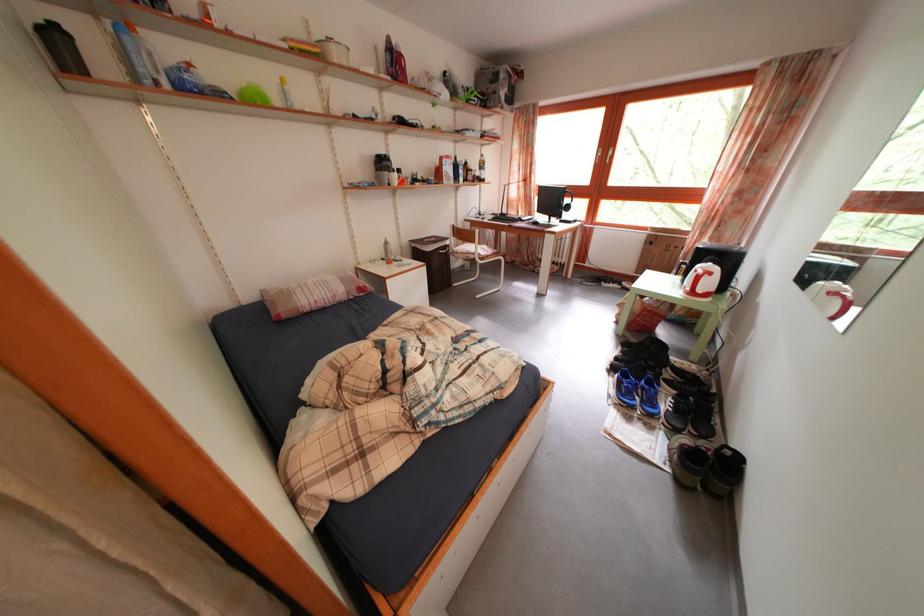
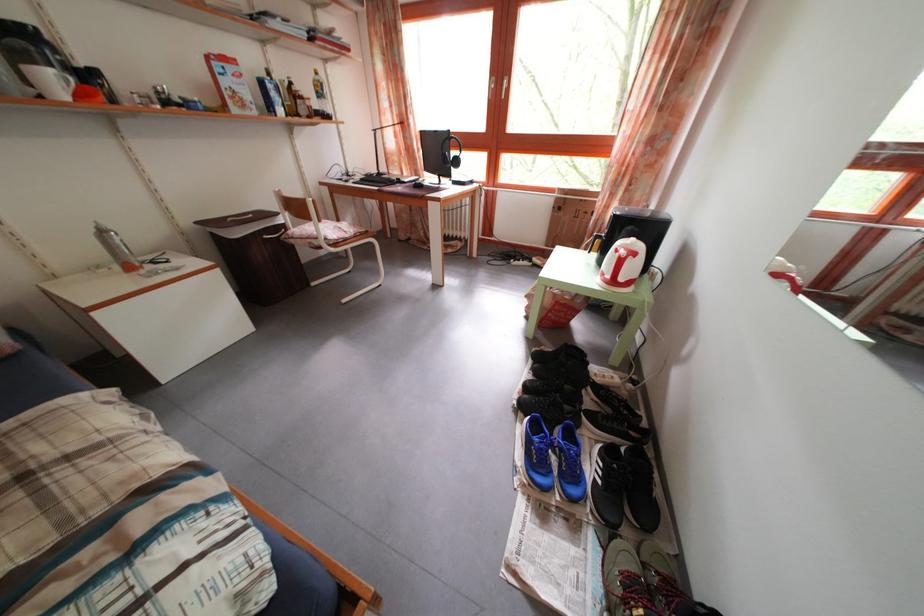
In the second image, find the point that corresponds to (402,185) in the first image.

(58, 87)